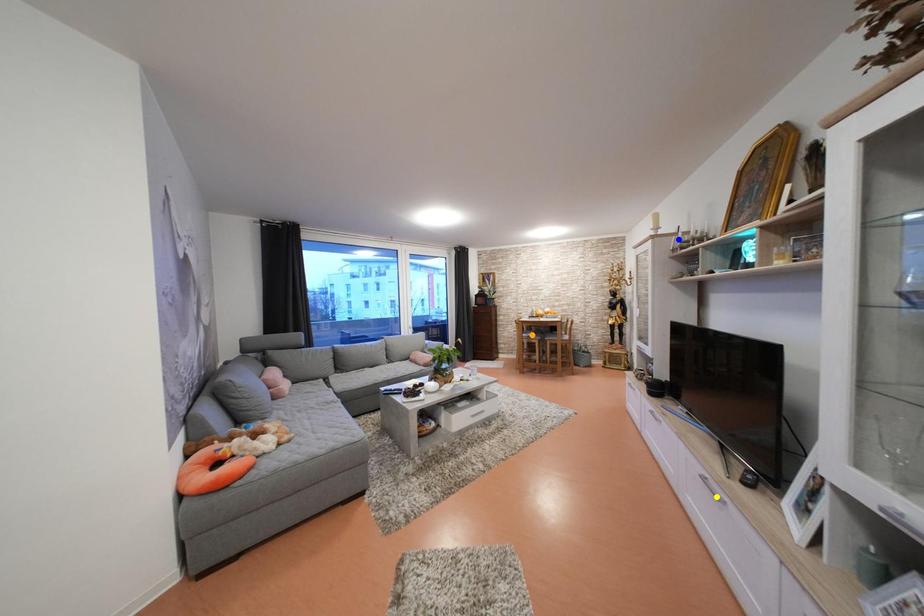
Order these from farthest to nearest:
blue point
yellow point
orange point

orange point
blue point
yellow point